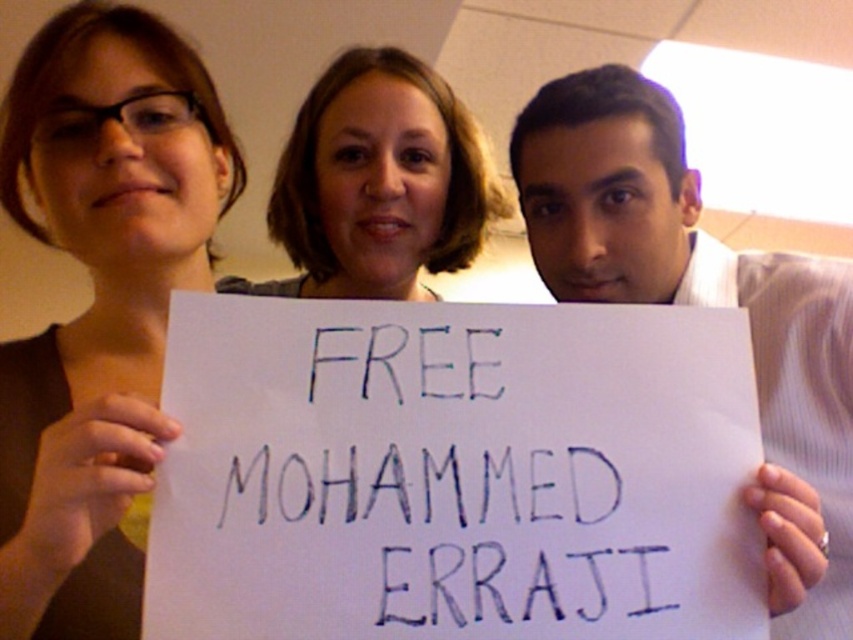
Question: Based on their relative distances, which object is nearer to the matte brown hair at upper left?

Choices:
 (A) smooth brown hair at center
 (B) white paper sign at center

Answer: (A)

Question: Is matte brown hair at upper left to the right of smooth brown hair at center from the viewer's perspective?

Choices:
 (A) no
 (B) yes

Answer: (A)

Question: Does matte brown hair at upper left have a greater width compared to smooth brown hair at center?

Choices:
 (A) no
 (B) yes

Answer: (B)

Question: Which object is closer to the camera taking this photo?

Choices:
 (A) smooth brown hair at center
 (B) matte brown hair at upper left
 (C) white paper sign at center

Answer: (B)

Question: Which point is closer to the camera taking this photo?

Choices:
 (A) (131, 99)
 (B) (564, 140)

Answer: (A)

Question: From the image, what is the correct spatial relationship of matte brown hair at upper left in relation to white paper sign at center?

Choices:
 (A) below
 (B) above

Answer: (B)